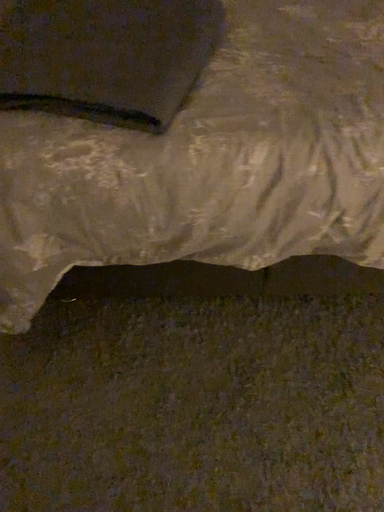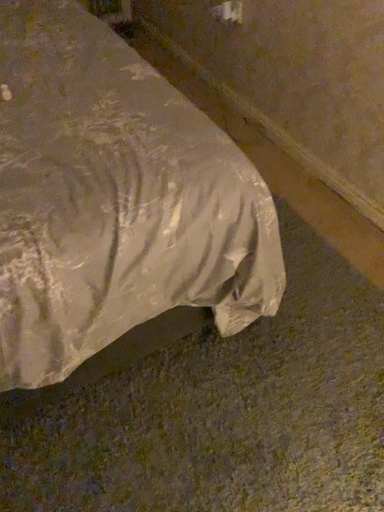
Question: How did the camera likely rotate when shooting the video?

Choices:
 (A) rotated downward
 (B) rotated upward

Answer: (B)